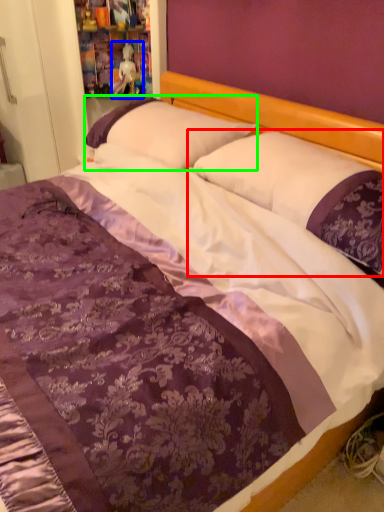
Question: Which object is positioned closest to pillow (highlighted by a red box)? Select from doll (highlighted by a blue box) and pillow (highlighted by a green box).

Choices:
 (A) doll
 (B) pillow

Answer: (B)